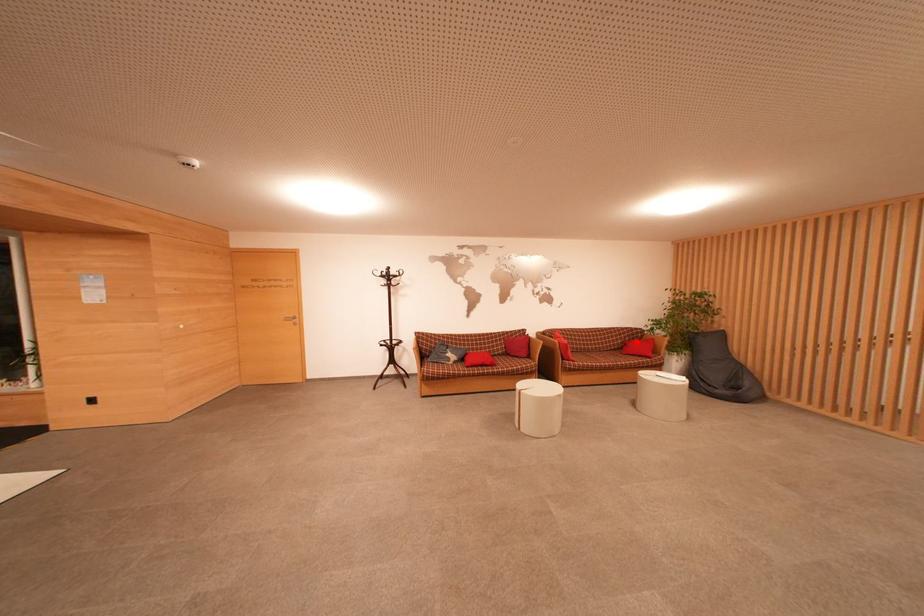
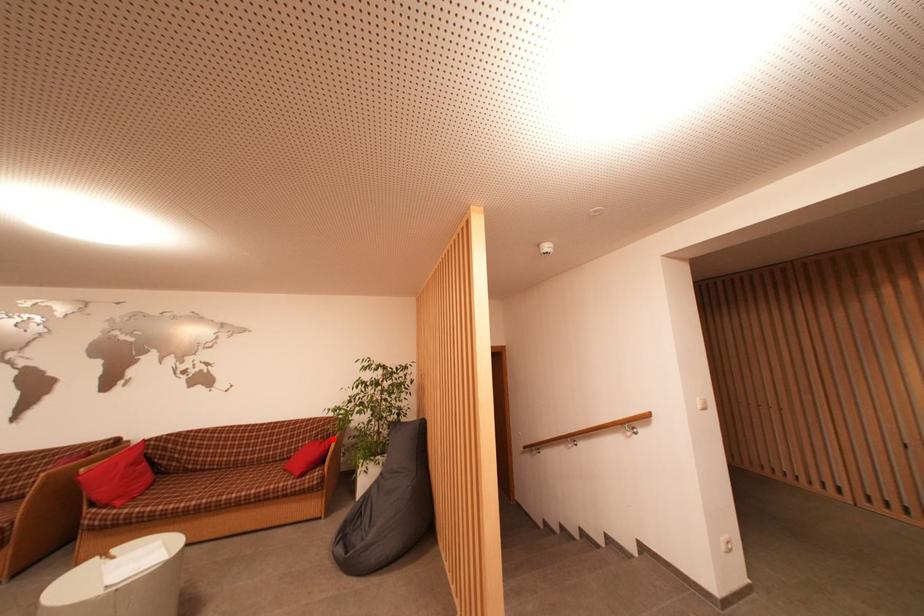
I am providing you with two images of the same scene from different viewpoints. A red point is marked on the first image and another point is marked on the second image. Is the red point in image1 aligned with the point shown in image2?

Yes